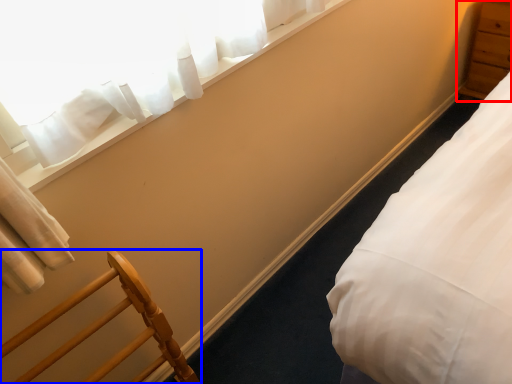
Question: Which object is further to the camera taking this photo, dresser (highlighted by a red box) or furniture (highlighted by a blue box)?

Choices:
 (A) dresser
 (B) furniture

Answer: (A)